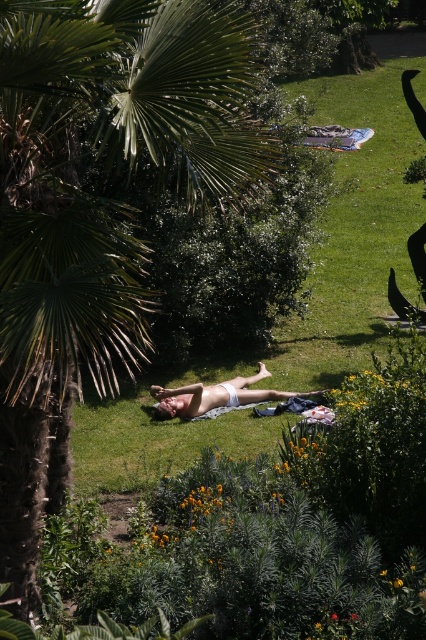
Question: Based on their relative distances, which object is nearer to the white fabric body at center?

Choices:
 (A) green leafy palm tree at left
 (B) green grass at center

Answer: (B)

Question: Does green leafy palm tree at left appear on the right side of green grass at center?

Choices:
 (A) yes
 (B) no

Answer: (B)

Question: Among these objects, which one is farthest from the camera?

Choices:
 (A) green leafy palm tree at left
 (B) white fabric body at center

Answer: (B)

Question: Does green leafy palm tree at left have a smaller size compared to green grass at center?

Choices:
 (A) no
 (B) yes

Answer: (B)

Question: Is green leafy palm tree at left below green grass at center?

Choices:
 (A) no
 (B) yes

Answer: (B)

Question: Which of these objects is positioned farthest from the white fabric body at center?

Choices:
 (A) green leafy palm tree at left
 (B) green grass at center

Answer: (A)